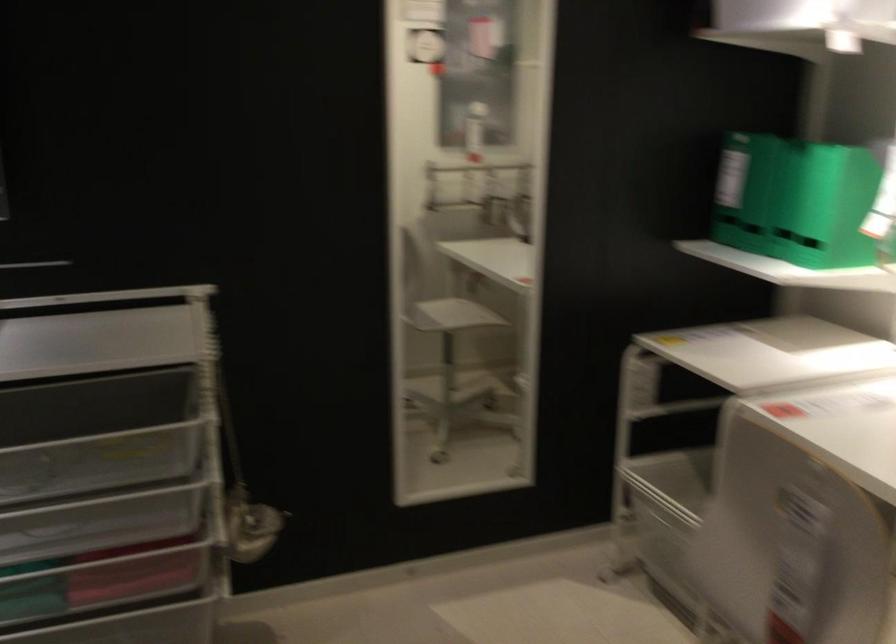
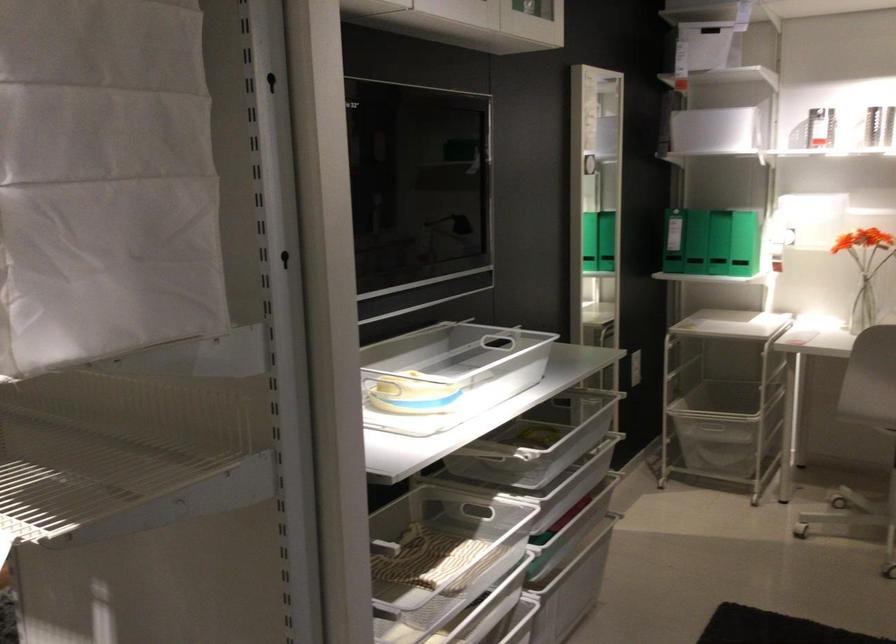
The point at (x=686, y=207) is marked in the first image. Where is the corresponding point in the second image?

(673, 241)